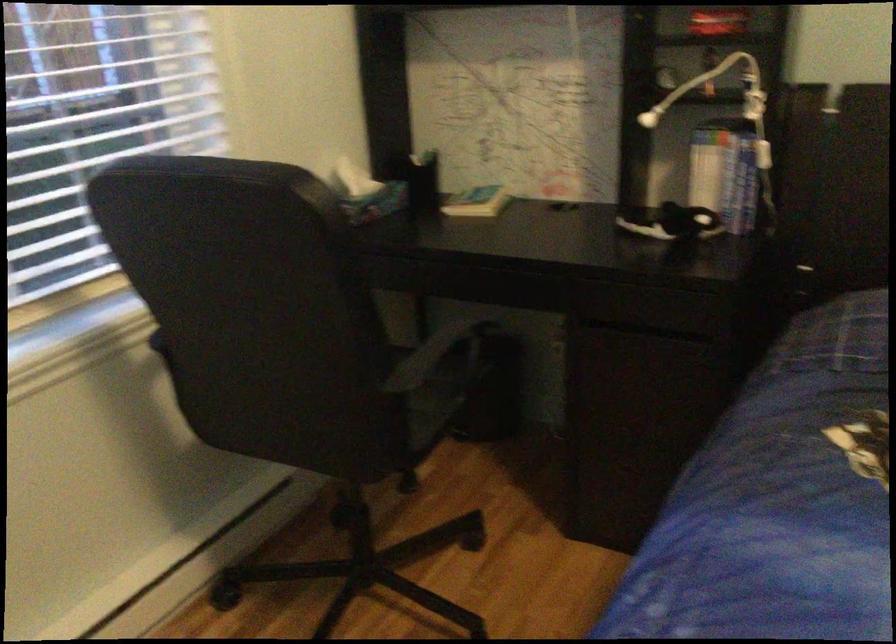
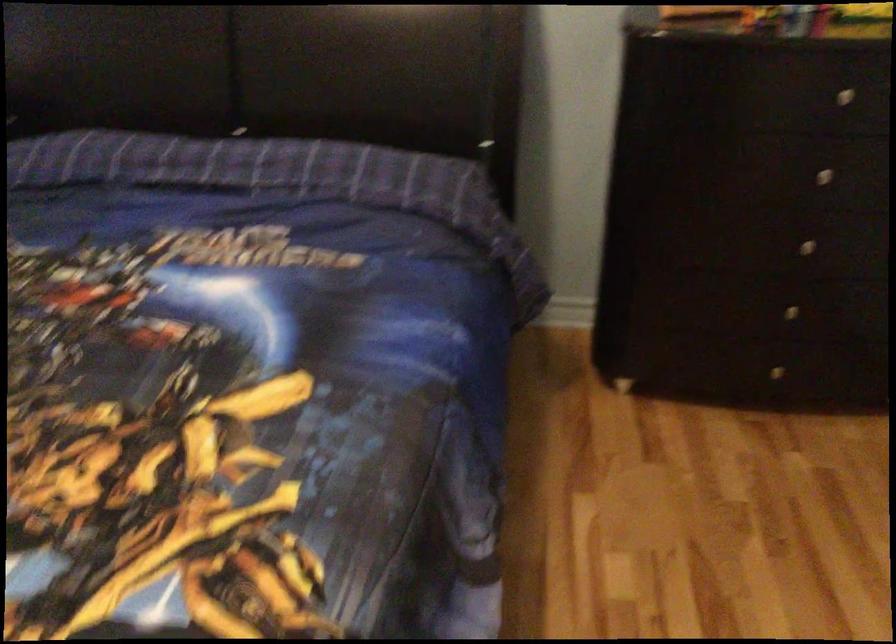
The images are taken continuously from a first-person perspective. In which direction are you moving?

The cameraman walked toward right, backward.